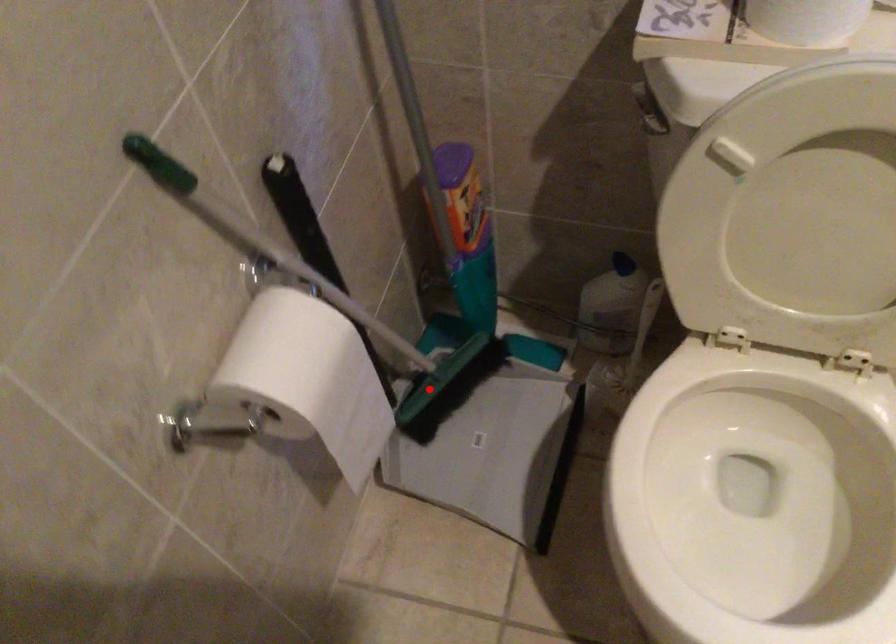
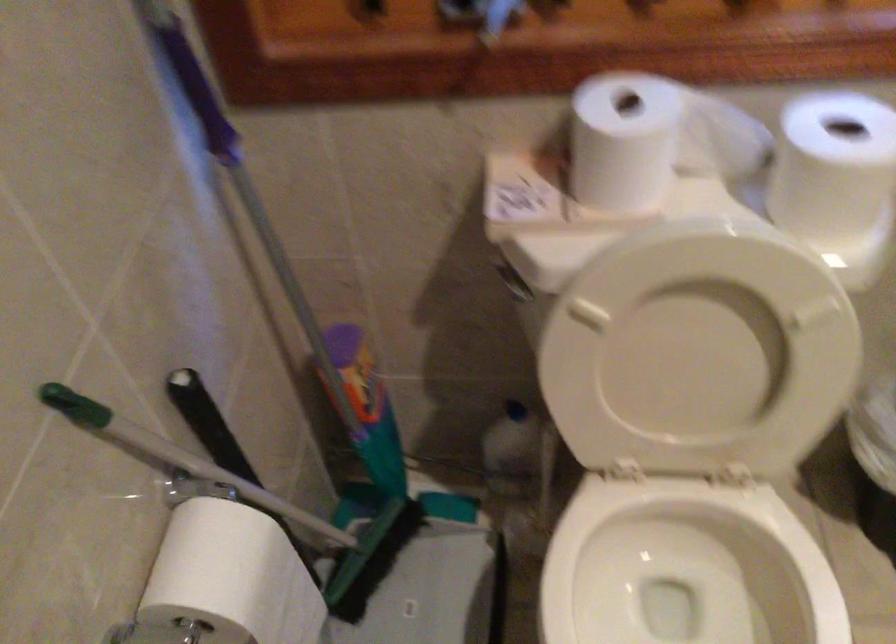
Locate, in the second image, the point that corresponds to the highlighted location in the first image.

(352, 564)